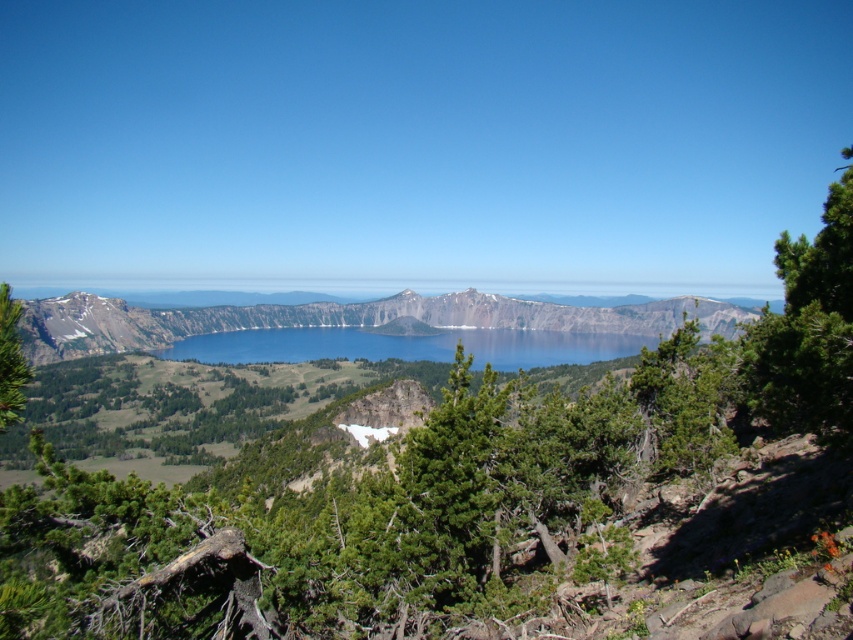
You are standing at the edge of the crater lake and want to take a photo of the rocky gray mountain at center. To ensure the mountain is centered in your photo, where should you position the camera relative to the landscape?

The rocky gray mountain at center is located at point coordinates (346, 320), so you should position the camera directly facing the center of the scene to capture the mountain at its central point.

You are a hiker standing at the edge of the crater lake. You notice the rocky gray mountain at center and the blue glassy water at center. Which object is taller?

The rocky gray mountain at center is taller than the blue glassy water at center.